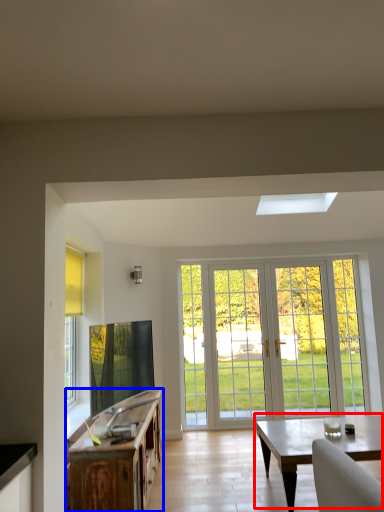
Question: Which of the following is the closest to the observer, coffee table (highlighted by a red box) or cabinetry (highlighted by a blue box)?

Choices:
 (A) coffee table
 (B) cabinetry

Answer: (B)